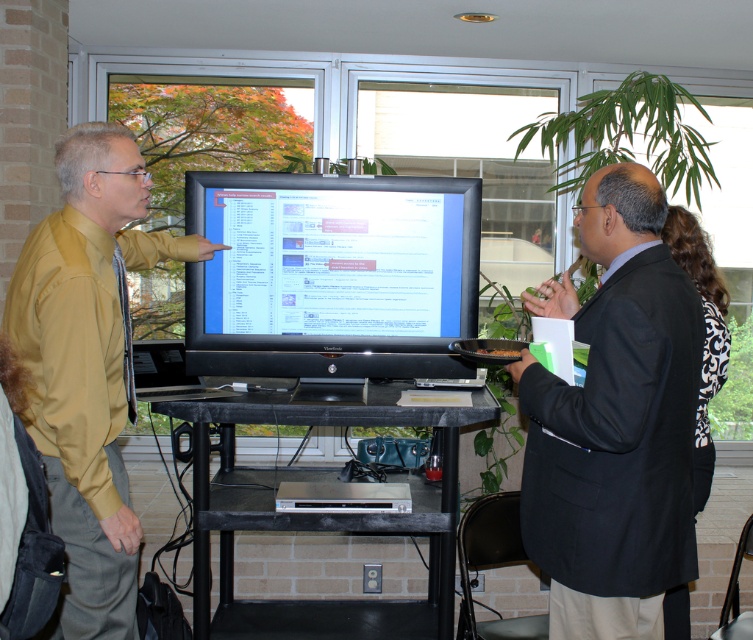
Question: Which of these objects is positioned closest to the black damask dress at right?

Choices:
 (A) matte yellow shirt at left
 (B) black suit at right
 (C) black matte table at center
 (D) matte black monitor at center

Answer: (B)

Question: In this image, where is black suit at right located relative to black damask dress at right?

Choices:
 (A) below
 (B) above

Answer: (A)

Question: Which of the following is the farthest from the observer?

Choices:
 (A) (229, 177)
 (B) (562, 292)

Answer: (A)

Question: Which point is farther to the camera?

Choices:
 (A) (590, 433)
 (B) (669, 595)
 (C) (252, 509)

Answer: (B)

Question: Is matte yellow shirt at left positioned in front of black matte table at center?

Choices:
 (A) no
 (B) yes

Answer: (B)

Question: Does matte yellow shirt at left have a smaller size compared to black matte table at center?

Choices:
 (A) no
 (B) yes

Answer: (B)